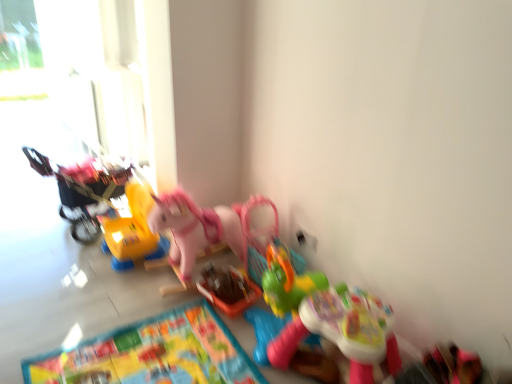
You are a GUI agent. You are given a task and a screenshot of the screen. Output one action in this format:
    pyautogui.click(x=<x>, y=<y>)
    Task: Click on the vacant area that lies between plastic basket at center, arranged as the fifth toy when viewed from the left, and multicolored fabric mat at lower center
    The height and width of the screenshot is (384, 512).
    Given the screenshot: What is the action you would take?
    pyautogui.click(x=211, y=333)